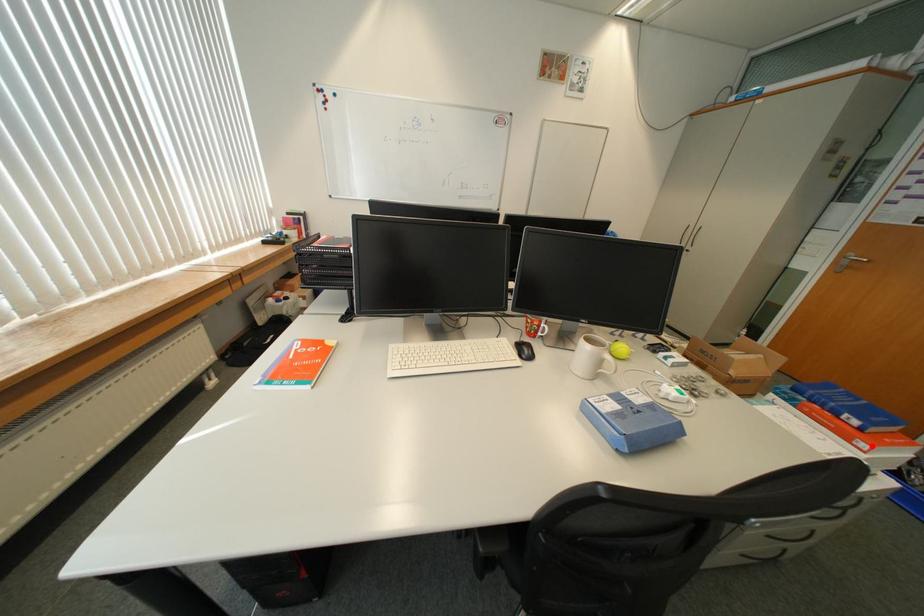
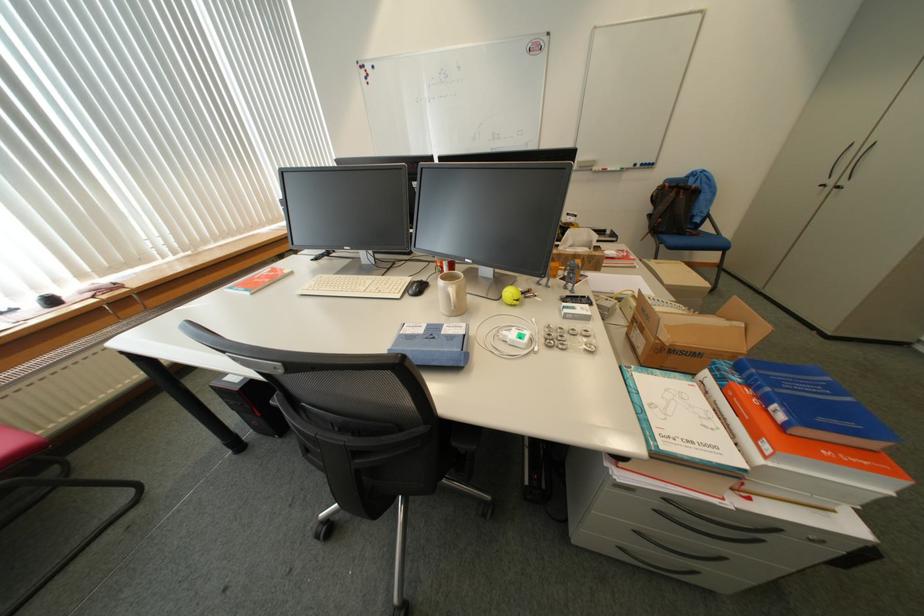
Question: I am providing you with two images of the same scene from different viewpoints. A red point is shown in image1. For the corresponding object point in image2, is it positioned nearer or farther from the camera?

Choices:
 (A) Nearer
 (B) Farther

Answer: (B)